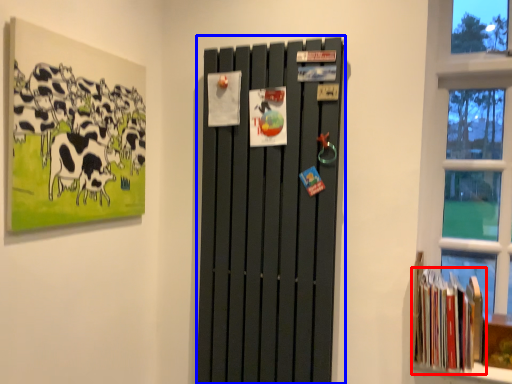
Question: Which of the following is the closest to the observer, book (highlighted by a red box) or barn door (highlighted by a blue box)?

Choices:
 (A) book
 (B) barn door

Answer: (B)